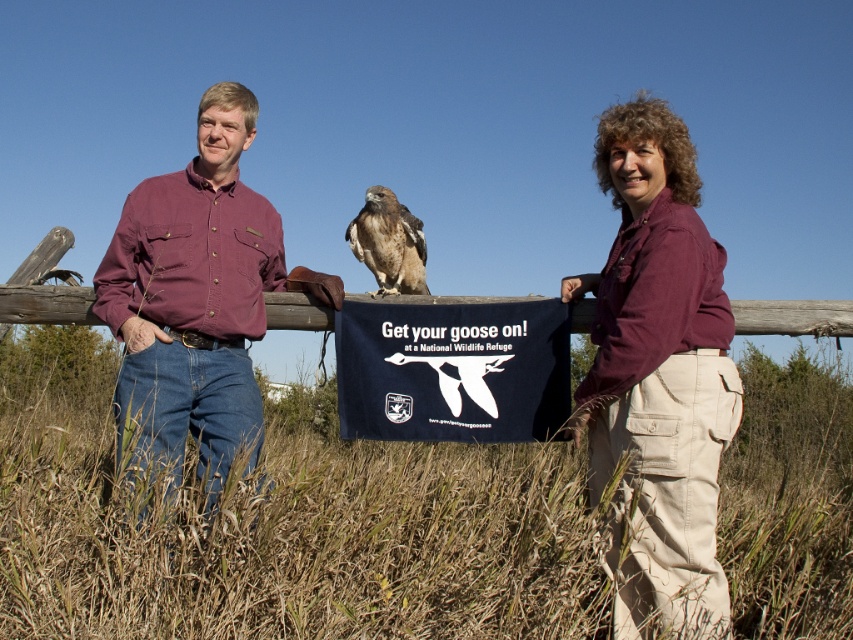
Which is below, maroon cotton shirt at center or brown feathered falcon at center?

Positioned lower is maroon cotton shirt at center.

Who is higher up, maroon cotton shirt at center or brown feathered falcon at center?

brown feathered falcon at center is higher up.

Where is `maroon cotton shirt at center`? This screenshot has height=640, width=853. maroon cotton shirt at center is located at coordinates (192, 300).

Find the location of `maroon cotton shirt at center`. maroon cotton shirt at center is located at coordinates (192, 300).

Which of these two, navy blue fabric sign at center or brown feathered falcon at center, stands shorter?

brown feathered falcon at center is shorter.

Is navy blue fabric sign at center to the left of brown feathered falcon at center from the viewer's perspective?

In fact, navy blue fabric sign at center is to the right of brown feathered falcon at center.

Is point (524, 326) positioned in front of point (378, 284)?

That is True.

At what (x,y) coordinates should I click in order to perform the action: click on navy blue fabric sign at center. Please return your answer as a coordinate pair (x, y). Looking at the image, I should click on (451, 371).

Is the position of maroon shirt at center more distant than that of matte purple shirt at center?

Yes, maroon shirt at center is further from the viewer.

Can you confirm if maroon shirt at center is smaller than matte purple shirt at center?

Incorrect, maroon shirt at center is not smaller in size than matte purple shirt at center.

Is point (631, 412) positioned in front of point (595, 410)?

That is True.

At what (x,y) coordinates should I click in order to perform the action: click on maroon shirt at center. Please return your answer as a coordinate pair (x, y). Looking at the image, I should click on (659, 376).